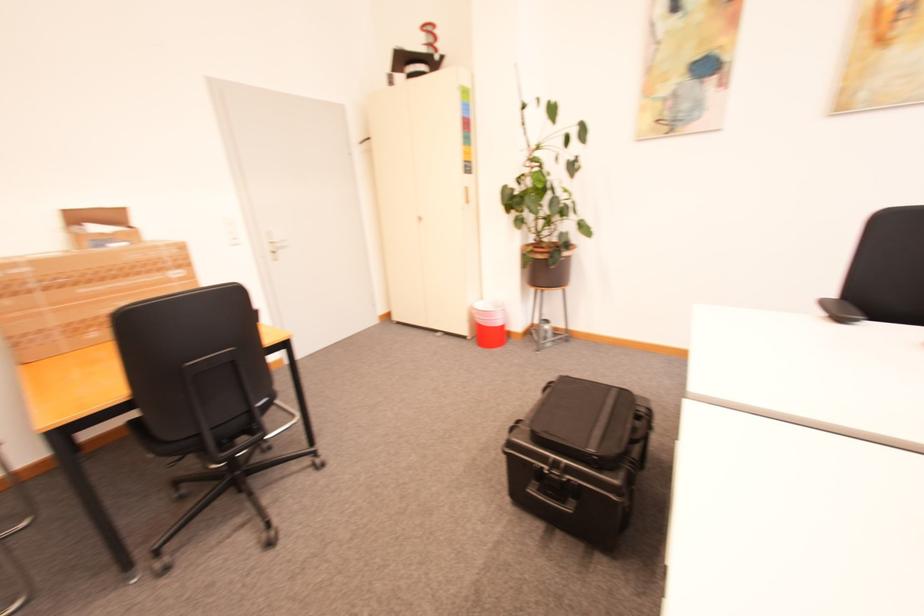
Find where to pull the beige cabinet handle. Please return your answer as a coordinate pair (x, y).

(470, 209)